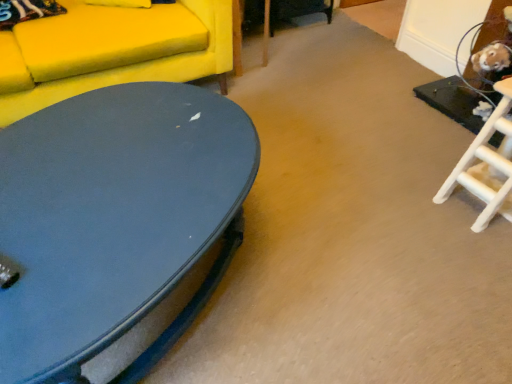
Question: Considering the relative sizes of matte yellow fabric couch at upper left and matte blue coffee table at lower left in the image provided, is matte yellow fabric couch at upper left bigger than matte blue coffee table at lower left?

Choices:
 (A) yes
 (B) no

Answer: (A)

Question: From a real-world perspective, is matte yellow fabric couch at upper left on top of matte blue coffee table at lower left?

Choices:
 (A) yes
 (B) no

Answer: (A)

Question: Is the depth of matte yellow fabric couch at upper left less than that of matte blue coffee table at lower left?

Choices:
 (A) no
 (B) yes

Answer: (A)

Question: Does matte yellow fabric couch at upper left have a greater width compared to matte blue coffee table at lower left?

Choices:
 (A) no
 (B) yes

Answer: (B)

Question: Does matte yellow fabric couch at upper left have a lesser width compared to matte blue coffee table at lower left?

Choices:
 (A) no
 (B) yes

Answer: (A)

Question: From a real-world perspective, is matte yellow fabric couch at upper left beneath matte blue coffee table at lower left?

Choices:
 (A) yes
 (B) no

Answer: (B)

Question: Is matte yellow fabric couch at upper left inside matte blue coffee table at lower left?

Choices:
 (A) no
 (B) yes

Answer: (A)

Question: Is matte blue coffee table at lower left touching matte yellow fabric couch at upper left?

Choices:
 (A) yes
 (B) no

Answer: (B)

Question: From the image's perspective, is matte blue coffee table at lower left over matte yellow fabric couch at upper left?

Choices:
 (A) yes
 (B) no

Answer: (B)

Question: Does matte blue coffee table at lower left have a smaller size compared to matte yellow fabric couch at upper left?

Choices:
 (A) yes
 (B) no

Answer: (A)

Question: Can you confirm if matte blue coffee table at lower left is thinner than matte yellow fabric couch at upper left?

Choices:
 (A) yes
 (B) no

Answer: (A)

Question: Does matte blue coffee table at lower left have a lesser height compared to matte yellow fabric couch at upper left?

Choices:
 (A) yes
 (B) no

Answer: (A)

Question: From a real-world perspective, is matte blue coffee table at lower left positioned above or below matte yellow fabric couch at upper left?

Choices:
 (A) below
 (B) above

Answer: (A)